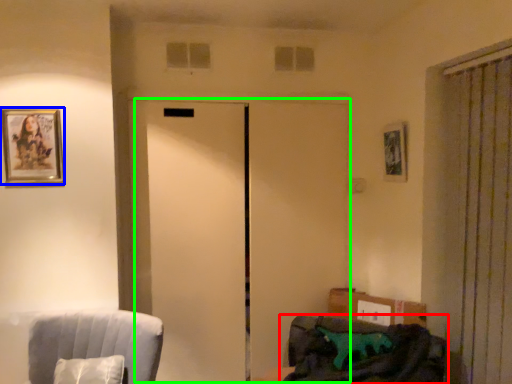
Question: Estimate the real-world distances between objects in this image. Which object is closer to furniture (highlighted by a red box), picture frame (highlighted by a blue box) or elevator (highlighted by a green box)?

Choices:
 (A) picture frame
 (B) elevator

Answer: (B)